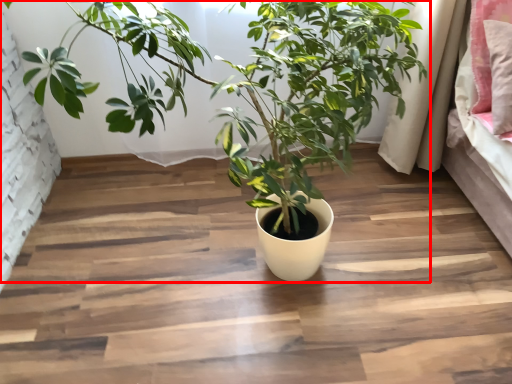
Question: Where is houseplant (annotated by the red box) located in relation to pillow in the image?

Choices:
 (A) left
 (B) right

Answer: (A)